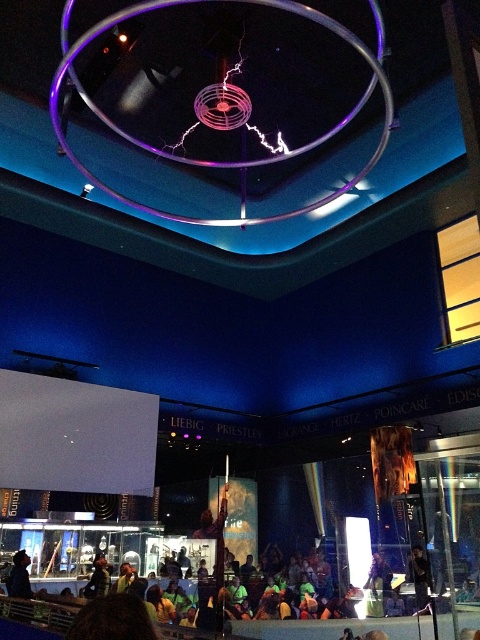
Which of these two, matte black jacket at lower left or black fabric at lower center, stands shorter?

With less height is black fabric at lower center.

This screenshot has height=640, width=480. What are the coordinates of `matte black jacket at lower left` in the screenshot? It's located at (19, 577).

You are a GUI agent. You are given a task and a screenshot of the screen. Output one action in this format:
    pyautogui.click(x=<x>, y=<y>)
    Task: Click on the matte black jacket at lower left
    Image resolution: width=480 pixels, height=640 pixels.
    Given the screenshot: What is the action you would take?
    pyautogui.click(x=19, y=577)

I want to click on matte black jacket at lower left, so click(19, 577).